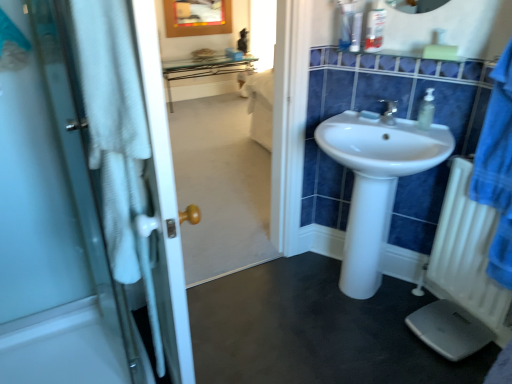
Question: Is black rubber mat at lower center oriented towards white glass door at left?

Choices:
 (A) no
 (B) yes

Answer: (A)

Question: From a real-world perspective, does black rubber mat at lower center stand above white glass door at left?

Choices:
 (A) yes
 (B) no

Answer: (B)

Question: Is the depth of black rubber mat at lower center greater than that of white glass door at left?

Choices:
 (A) yes
 (B) no

Answer: (A)

Question: Would you say white glass door at left is part of black rubber mat at lower center's contents?

Choices:
 (A) yes
 (B) no

Answer: (B)

Question: Are black rubber mat at lower center and white glass door at left far apart?

Choices:
 (A) yes
 (B) no

Answer: (B)

Question: Choose the correct answer: Is translucent plastic soap dispenser at upper right inside white glass door at left or outside it?

Choices:
 (A) outside
 (B) inside

Answer: (A)

Question: In terms of width, does translucent plastic soap dispenser at upper right look wider or thinner when compared to white glass door at left?

Choices:
 (A) thin
 (B) wide

Answer: (A)

Question: Based on their positions, is translucent plastic soap dispenser at upper right located to the left or right of white glass door at left?

Choices:
 (A) right
 (B) left

Answer: (A)

Question: From the image's perspective, is translucent plastic soap dispenser at upper right above or below white glass door at left?

Choices:
 (A) below
 (B) above

Answer: (B)

Question: Based on their positions, is translucent plastic bottle at upper right, which ranks as the third toiletry in left-to-right order, located to the left or right of white plastic radiator at lower right?

Choices:
 (A) right
 (B) left

Answer: (B)

Question: Considering the positions of translucent plastic bottle at upper right, which ranks as the third toiletry in left-to-right order, and white plastic radiator at lower right in the image, is translucent plastic bottle at upper right, which ranks as the third toiletry in left-to-right order, wider or thinner than white plastic radiator at lower right?

Choices:
 (A) thin
 (B) wide

Answer: (A)

Question: From a real-world perspective, relative to white plastic radiator at lower right, is translucent plastic bottle at upper right, which appears as the first toiletry when viewed from the right, vertically above or below?

Choices:
 (A) above
 (B) below

Answer: (A)

Question: In terms of size, does translucent plastic bottle at upper right, which appears as the first toiletry when viewed from the right, appear bigger or smaller than white plastic radiator at lower right?

Choices:
 (A) big
 (B) small

Answer: (B)

Question: From the image's perspective, relative to white plastic radiator at lower right, is white matte soap at center above or below?

Choices:
 (A) above
 (B) below

Answer: (A)

Question: In terms of size, does white matte soap at center appear bigger or smaller than white plastic radiator at lower right?

Choices:
 (A) big
 (B) small

Answer: (B)